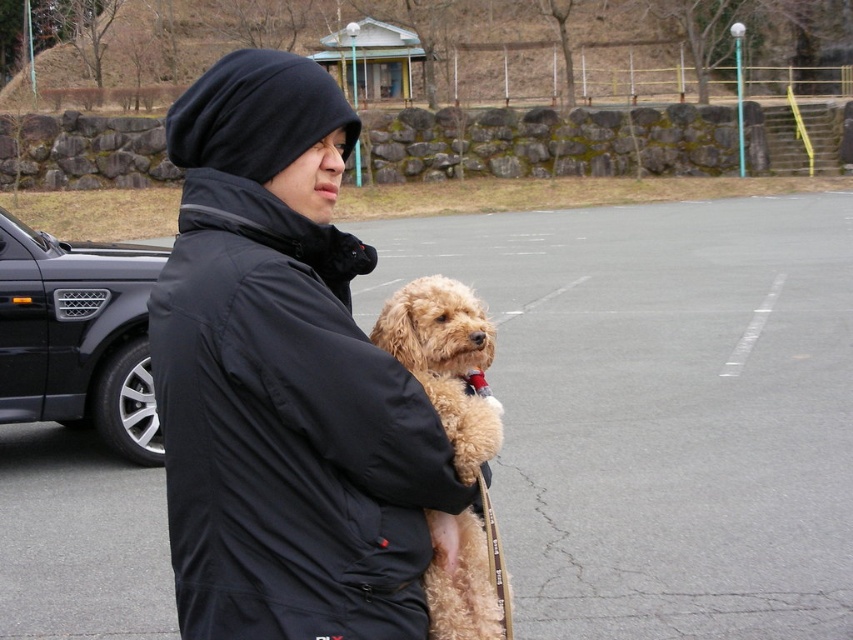
Question: Where is black matte jacket at center located in relation to fuzzy beige dog at center in the image?

Choices:
 (A) below
 (B) above

Answer: (B)

Question: Estimate the real-world distances between objects in this image. Which object is farther from the fuzzy beige dog at center?

Choices:
 (A) gray asphalt parking lot at center
 (B) black matte jacket at center
 (C) black metallic car at left

Answer: (A)

Question: Does gray asphalt parking lot at center appear under fuzzy beige dog at center?

Choices:
 (A) no
 (B) yes

Answer: (A)

Question: Based on their relative distances, which object is farther from the fuzzy beige dog at center?

Choices:
 (A) black matte jacket at center
 (B) black metallic car at left

Answer: (B)

Question: Which is nearer to the black matte jacket at center?

Choices:
 (A) black metallic car at left
 (B) gray asphalt parking lot at center

Answer: (A)

Question: Can you confirm if black metallic car at left is positioned to the right of fuzzy beige dog at center?

Choices:
 (A) yes
 (B) no

Answer: (B)